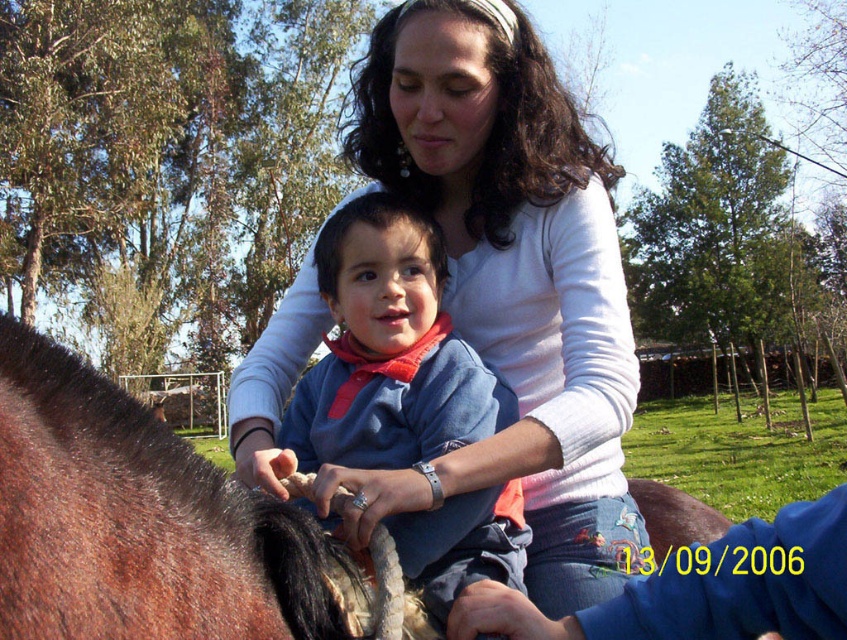
You are a photographer taking a picture of the scene. You need to ensure that the white matte shirt at center and the brown fuzzy horse at left are both clearly visible. Which object should you focus on first to ensure proper exposure, considering their sizes?

The white matte shirt at center is bigger than the brown fuzzy horse at left, so you should focus on the white matte shirt at center first to ensure proper exposure since larger objects require more attention to capture details accurately.

You are a photographer trying to capture a group photo of the brown fuzzy horse at left and the blue cotton shirt at center. Since the horse is smaller, where should you position them to make them appear the same size in the photo?

To make the brown fuzzy horse at left and the blue cotton shirt at center appear the same size in the photo, position the smaller brown fuzzy horse at left closer to the camera and the larger blue cotton shirt at center farther away. This adjustment balances their apparent sizes due to perspective.

You are standing at the center of the image. Which direction should you move to reach the brown fuzzy horse at left?

Since the brown fuzzy horse at left is located at point (x=136, y=520), you should move to the left to reach it.